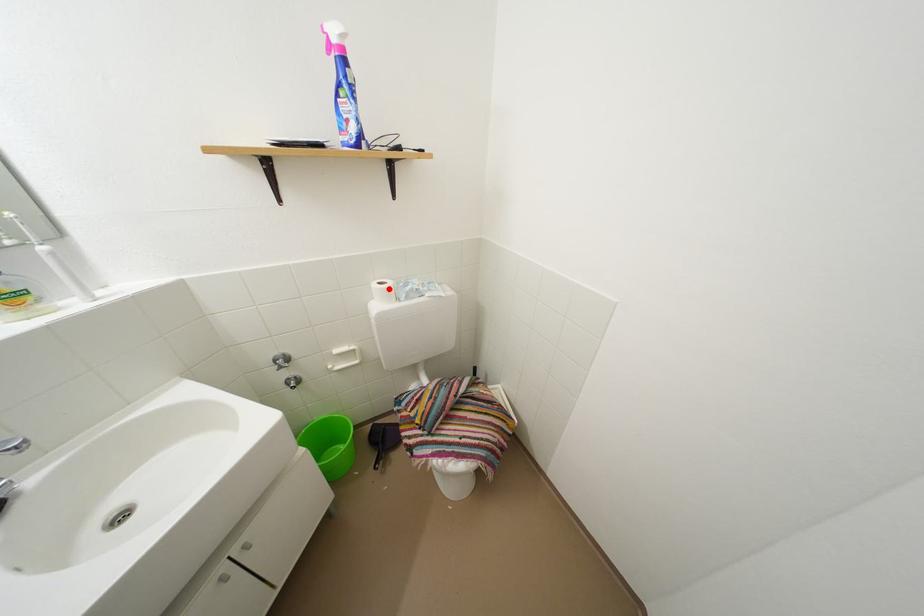
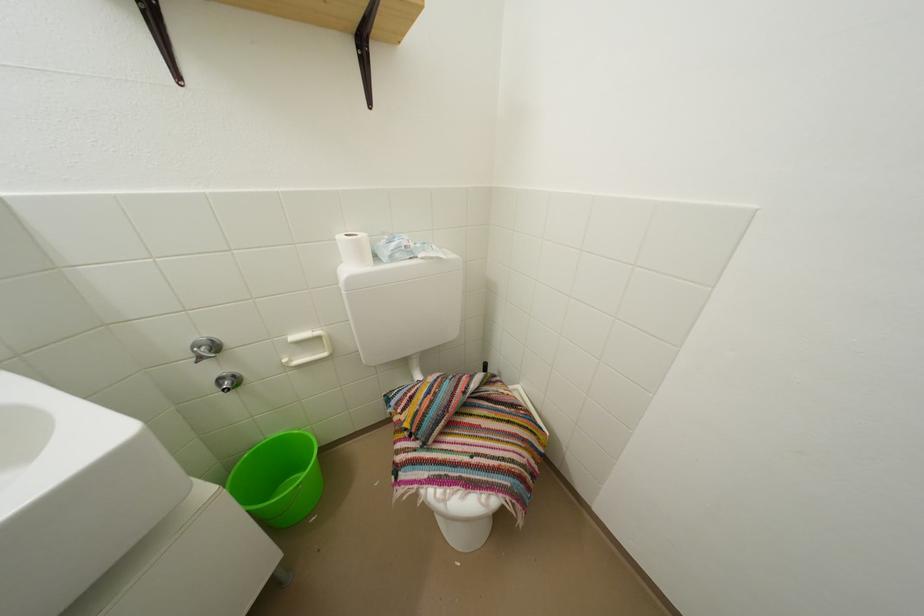
In the second image, find the point that corresponds to the highlighted location in the first image.

(360, 240)